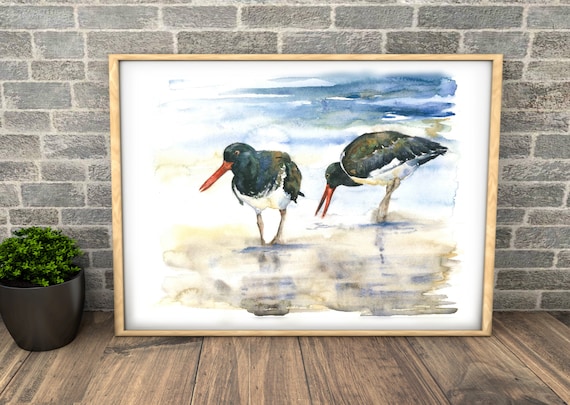
The height and width of the screenshot is (405, 570). I want to click on frame, so click(x=113, y=83).